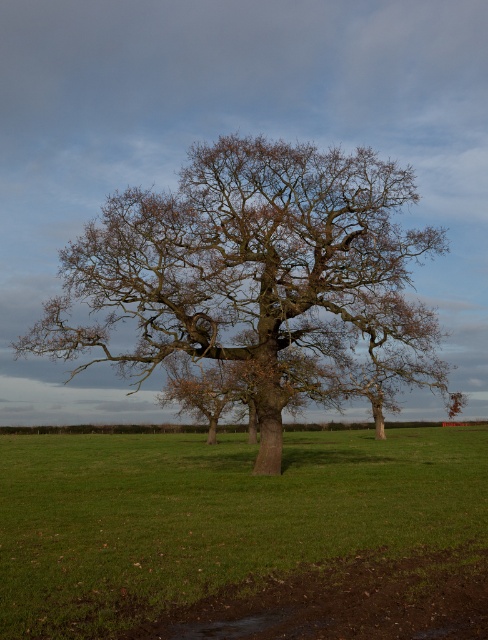
Who is shorter, brown rough bark oak tree at center or green grass at center?

green grass at center

Who is taller, brown rough bark oak tree at center or green grass at center?

With more height is brown rough bark oak tree at center.

Where is `brown rough bark oak tree at center`? The image size is (488, 640). brown rough bark oak tree at center is located at coordinates (258, 278).

What are the coordinates of `brown rough bark oak tree at center` in the screenshot? It's located at (258, 278).